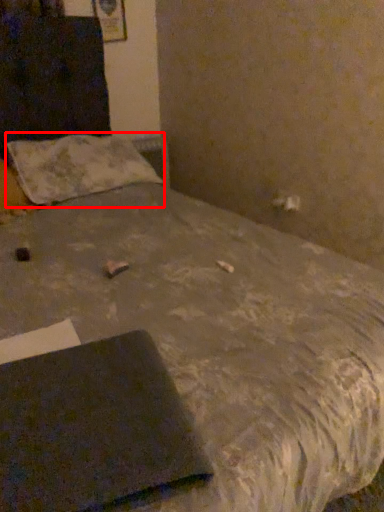
Question: From the image, what is the correct spatial relationship of pillow (annotated by the red box) in relation to notebook?

Choices:
 (A) right
 (B) left

Answer: (B)